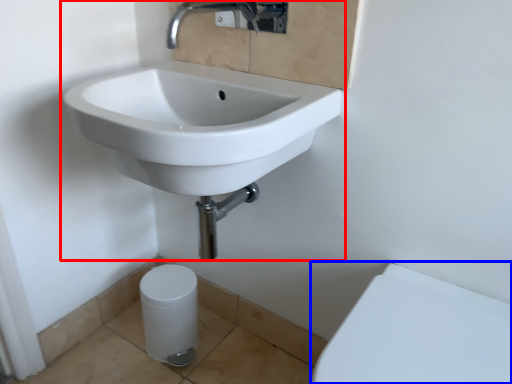
Question: Which object is further to the camera taking this photo, sink (highlighted by a red box) or porcelain (highlighted by a blue box)?

Choices:
 (A) sink
 (B) porcelain

Answer: (A)